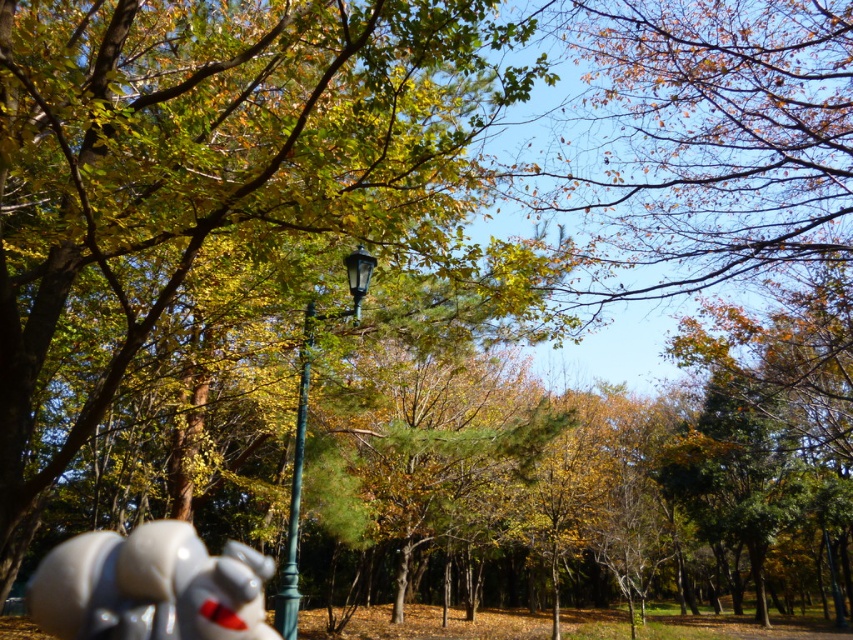
You are a photographer trying to capture a photo where both the white glossy statue at lower left and the green metal lamp post at center are clearly visible. Considering their sizes, which object might appear larger in the final image?

The white glossy statue at lower left appears larger in the photo because it is much taller than the green metal lamp post at center.

You are a photographer setting up a shot of the autumn park scene. You want to ensure the white glossy statue at lower left and the green metal lamp post at center are both in frame. Based on their positions, which object should you focus on first to capture both in the shot?

The white glossy statue at lower left is below the green metal lamp post at center, so you should focus on the green metal lamp post at center first to ensure both are in frame.

You are standing in the park and see the point at coordinates [149,586]. Which object is this point located on?

The point at coordinates [149,586] is located on the white glossy statue at lower left.